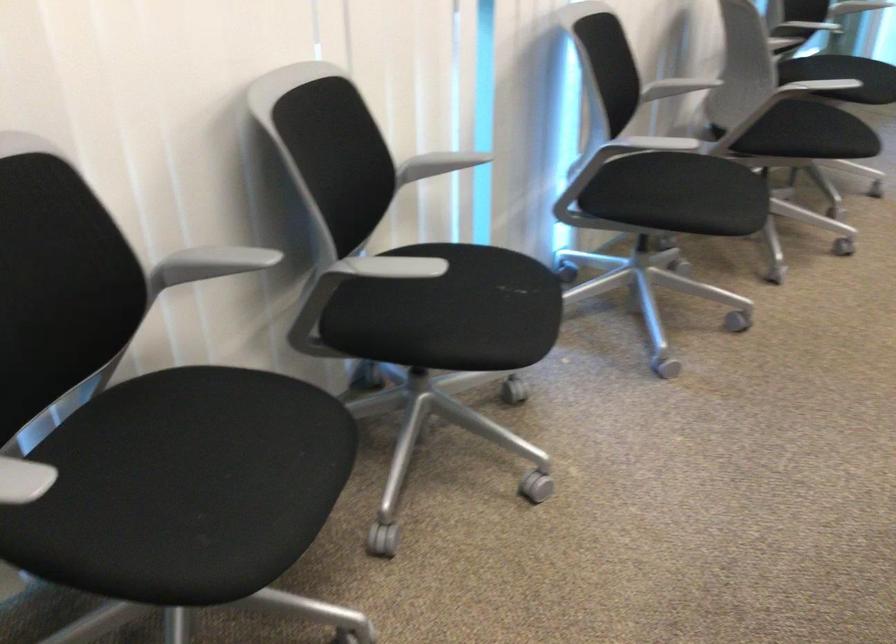
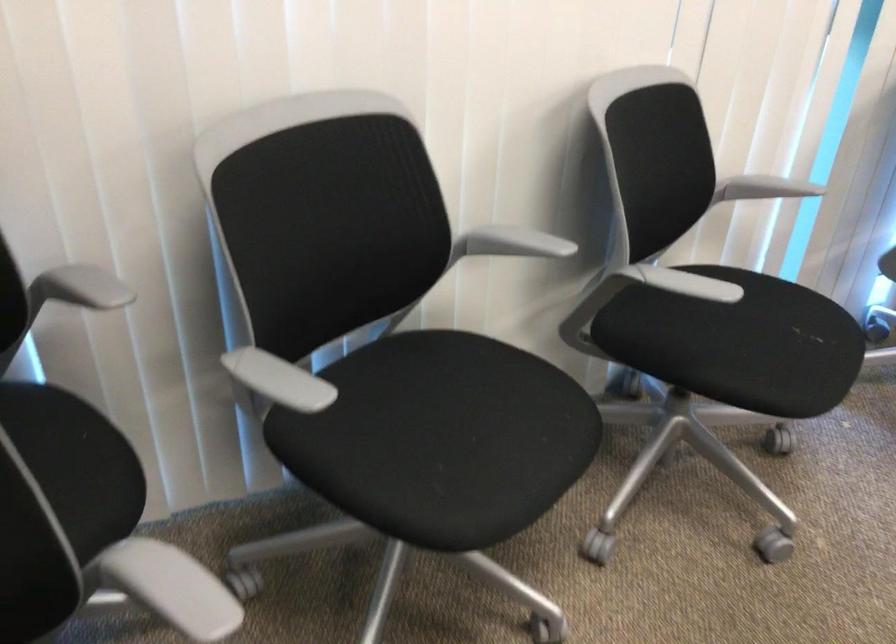
Question: The first image is from the beginning of the video and the second image is from the end. How did the camera likely rotate when shooting the video?

Choices:
 (A) Left
 (B) Right
 (C) Up
 (D) Down

Answer: (A)